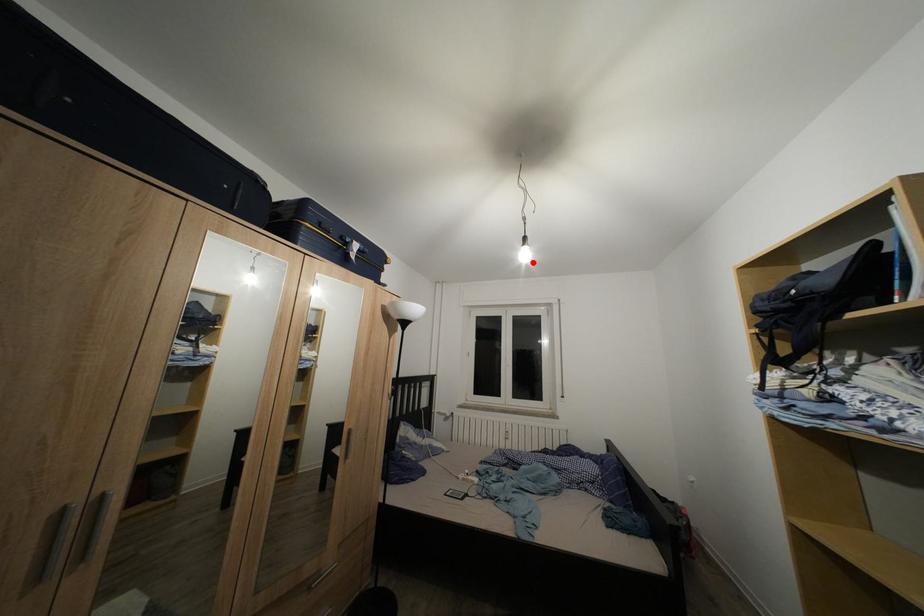
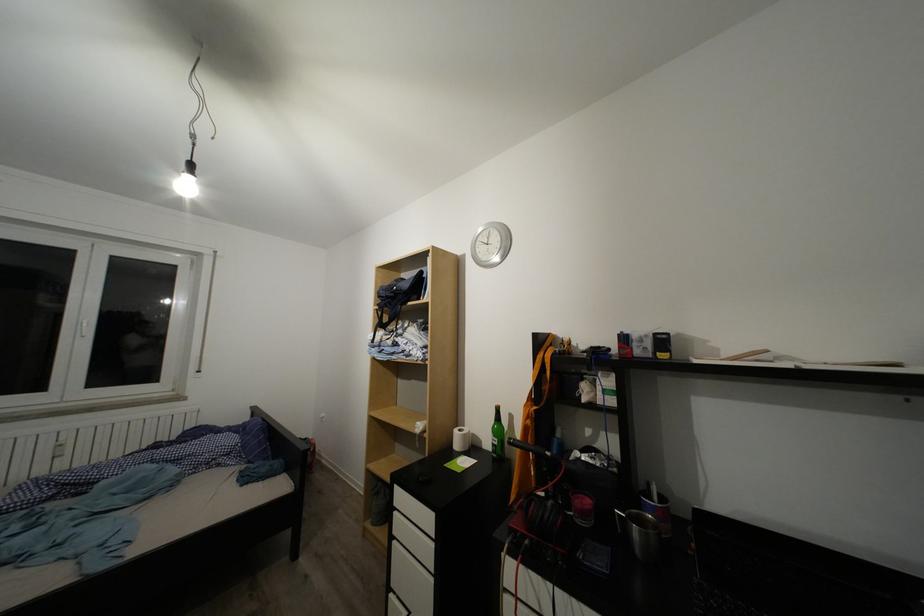
The point at the highlighted location is marked in the first image. Where is the corresponding point in the second image?

(193, 195)